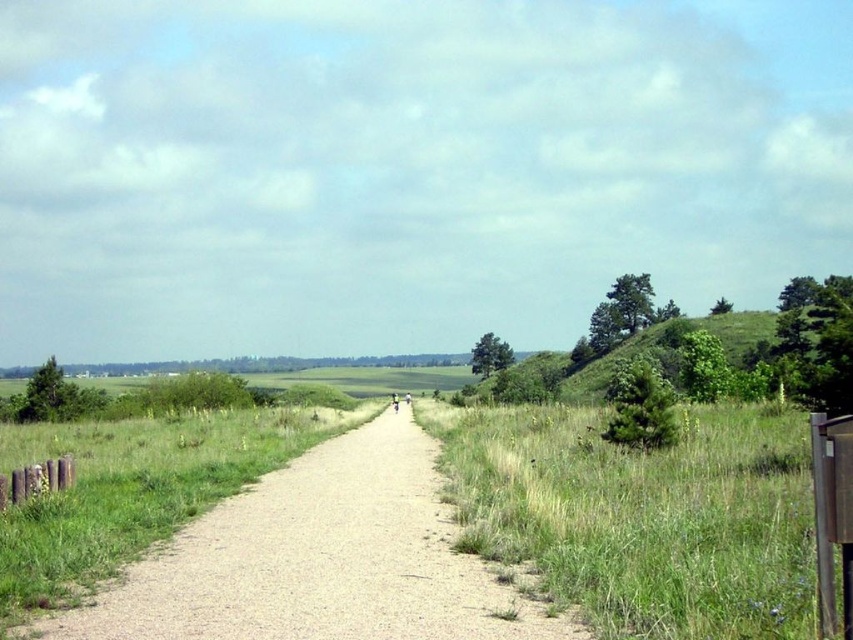
Which is below, green grassy at right or gravel path at center?

Positioned lower is gravel path at center.

Which is above, green grassy at right or gravel path at center?

Positioned higher is green grassy at right.

Who is more distant from viewer, [786,589] or [241,634]?

Positioned behind is point [786,589].

Where is `green grassy at right`? green grassy at right is located at coordinates (643, 515).

The width and height of the screenshot is (853, 640). Find the location of `green grassy at right`. green grassy at right is located at coordinates (643, 515).

Does green grassy at right have a larger size compared to green grassy hill at right?

Incorrect, green grassy at right is not larger than green grassy hill at right.

Which is behind, point (744, 483) or point (601, 368)?

Point (601, 368)

Identify the location of green grassy at right. (643, 515).

Which is in front, point (358, 564) or point (573, 380)?

Point (358, 564) is more forward.

Find the location of a particular element. The image size is (853, 640). gravel path at center is located at coordinates (320, 560).